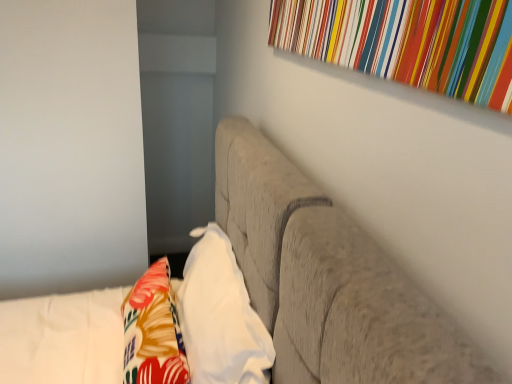
Question: From the image's perspective, does floral fabric throw pillow at lower left appear lower than textured gray sofa at center?

Choices:
 (A) no
 (B) yes

Answer: (A)

Question: Is floral fabric throw pillow at lower left completely or partially outside of textured gray sofa at center?

Choices:
 (A) no
 (B) yes

Answer: (A)

Question: Does floral fabric throw pillow at lower left have a lesser height compared to textured gray sofa at center?

Choices:
 (A) no
 (B) yes

Answer: (B)

Question: From a real-world perspective, is floral fabric throw pillow at lower left on textured gray sofa at center?

Choices:
 (A) no
 (B) yes

Answer: (B)

Question: Is the position of floral fabric throw pillow at lower left less distant than that of textured gray sofa at center?

Choices:
 (A) no
 (B) yes

Answer: (A)

Question: Is textured gray sofa at center at the back of floral fabric throw pillow at lower left?

Choices:
 (A) yes
 (B) no

Answer: (A)

Question: Does multicolored striped fabric at upper right have a smaller size compared to textured gray sofa at center?

Choices:
 (A) yes
 (B) no

Answer: (A)

Question: Considering the relative sizes of multicolored striped fabric at upper right and textured gray sofa at center in the image provided, is multicolored striped fabric at upper right bigger than textured gray sofa at center?

Choices:
 (A) yes
 (B) no

Answer: (B)

Question: Can you confirm if multicolored striped fabric at upper right is shorter than textured gray sofa at center?

Choices:
 (A) no
 (B) yes

Answer: (B)

Question: From the image's perspective, is multicolored striped fabric at upper right on textured gray sofa at center?

Choices:
 (A) yes
 (B) no

Answer: (A)

Question: Can you confirm if multicolored striped fabric at upper right is positioned to the right of textured gray sofa at center?

Choices:
 (A) no
 (B) yes

Answer: (B)

Question: Does multicolored striped fabric at upper right come behind textured gray sofa at center?

Choices:
 (A) no
 (B) yes

Answer: (B)

Question: Is white soft pillow at center smaller than floral fabric throw pillow at lower left?

Choices:
 (A) yes
 (B) no

Answer: (B)